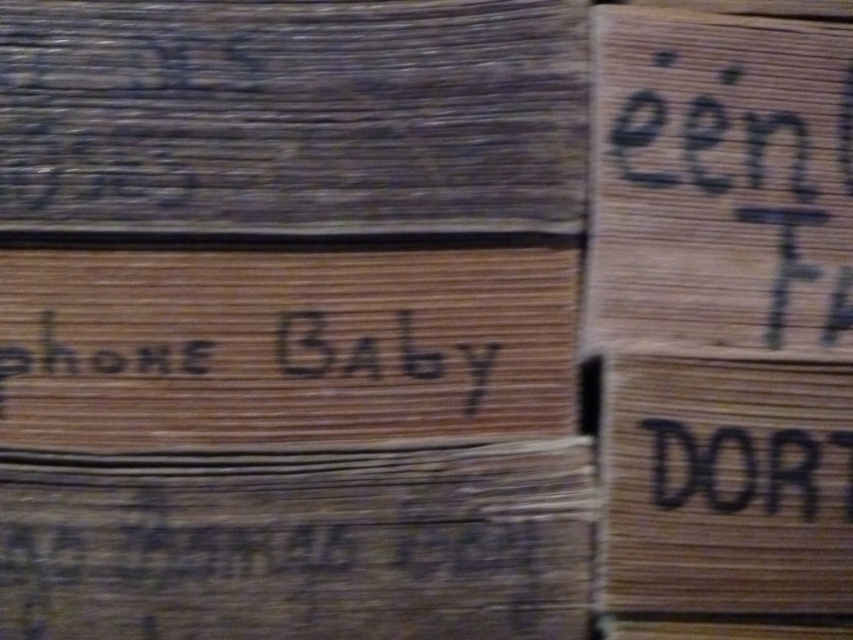
You are standing in front of two wooden crates labeled with text. The first crate has coordinates at point (769, 540) and the second at point (287, 317). Which crate do you perceive as being closer to you based on their positions?

Point (769, 540) is closer to the viewer than point (287, 317), so the first crate at point (769, 540) appears closer.

Looking at the scene with the wooden signboard at center and the black cardboard at right, which object is positioned to the left of the other?

The wooden signboard at center is positioned to the left of the black cardboard at right.

You are standing at the point marked as point (521, 212). You want to move to the nearest door, which is 40 inches away from you. Can you reach the door without moving more than 40 inches?

The distance between point (521, 212) and the viewer is 37.58 inches, so yes, you can reach the door without moving more than 40 inches since 37.58 is less than 40.